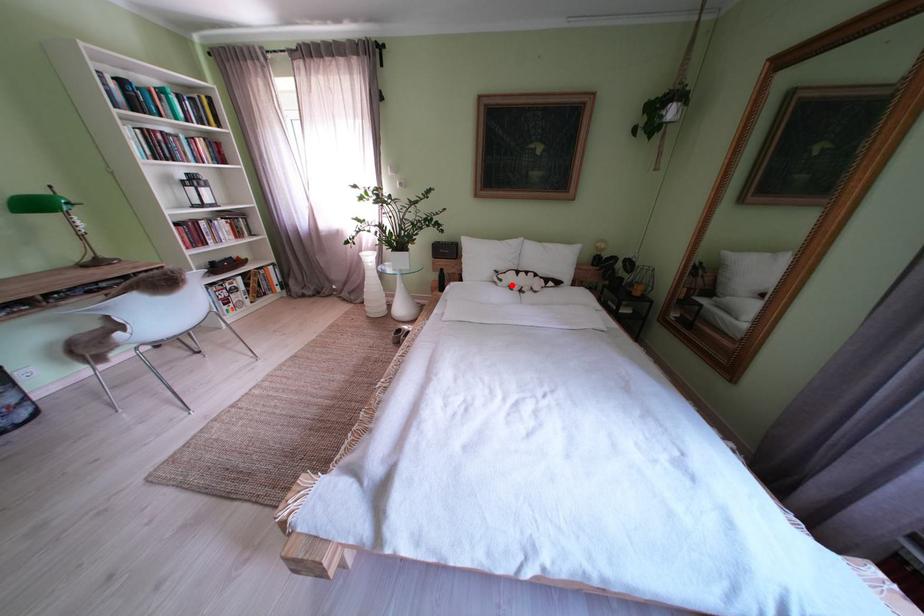
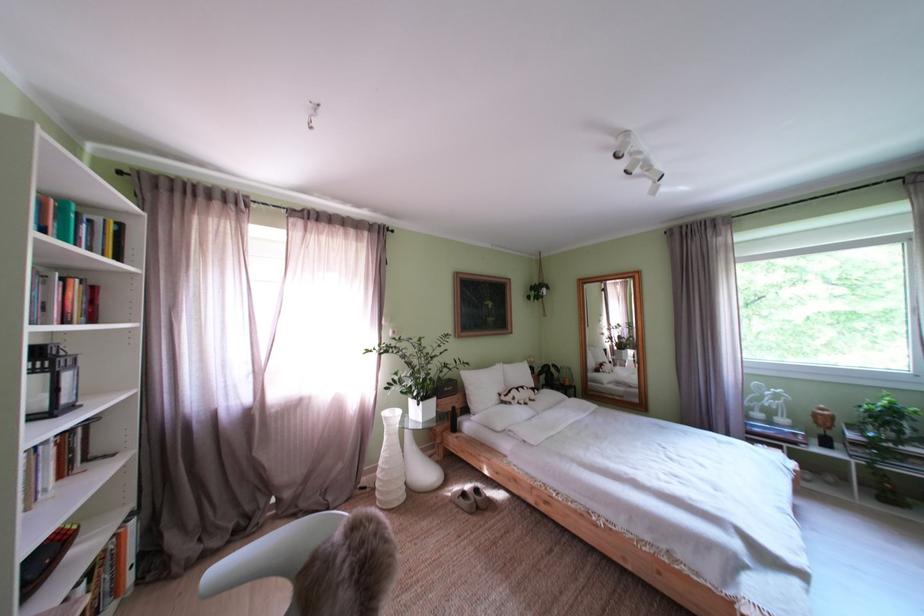
The point at the highlighted location is marked in the first image. Where is the corresponding point in the second image?

(525, 405)